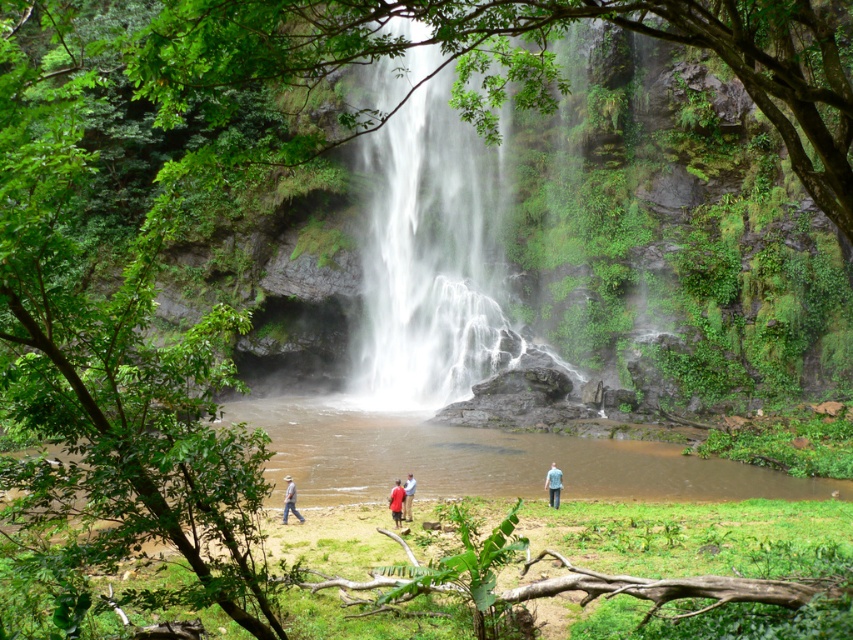
Question: Which point is farther from the camera taking this photo?

Choices:
 (A) (448, 76)
 (B) (398, 481)

Answer: (A)

Question: Does blue denim jeans at lower center appear over matte red shirt at center?

Choices:
 (A) no
 (B) yes

Answer: (B)

Question: Is blue denim jeans at lower center positioned behind reddish-brown leather jacket at center?

Choices:
 (A) yes
 (B) no

Answer: (A)

Question: Which is farther from the blue denim jeans at lower center?

Choices:
 (A) white silky waterfall at center
 (B) matte red shirt at center
 (C) reddish-brown leather jacket at center
 (D) brown leather hat at lower left

Answer: (A)

Question: Which of the following is the farthest from the observer?

Choices:
 (A) (x=413, y=480)
 (B) (x=556, y=481)

Answer: (B)

Question: Is blue denim jeans at lower center above brown leather hat at lower left?

Choices:
 (A) yes
 (B) no

Answer: (A)